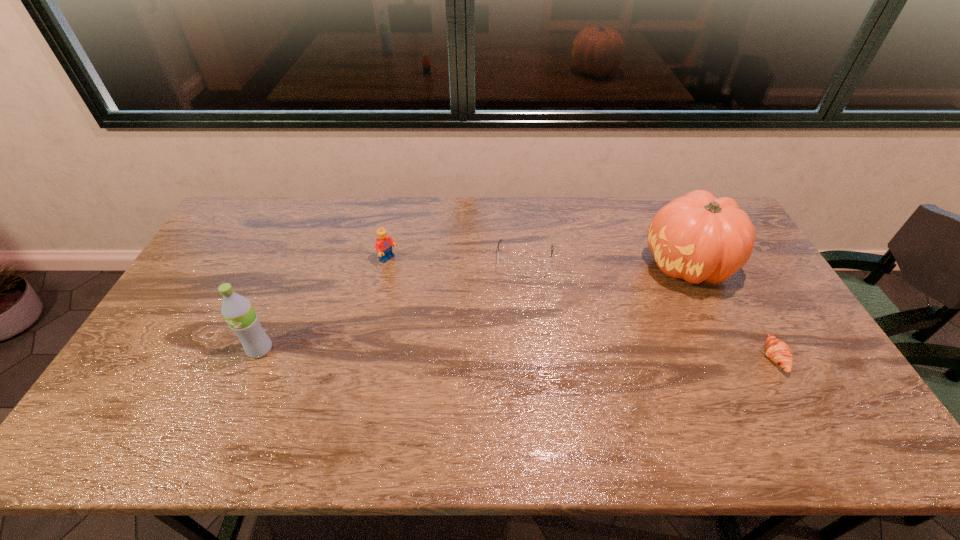
The image size is (960, 540). In order to click on vacant space located 0.130m on the front-facing side of the shortest object in this screenshot , I will do `click(715, 357)`.

You are a GUI agent. You are given a task and a screenshot of the screen. Output one action in this format:
    pyautogui.click(x=<x>, y=<y>)
    Task: Click on the vacant region located through the lenses of the spectacles
    The width and height of the screenshot is (960, 540).
    Given the screenshot: What is the action you would take?
    pyautogui.click(x=518, y=307)

Identify the location of free space located through the lenses of the spectacles. The width and height of the screenshot is (960, 540). (511, 354).

I want to click on free space located 0.400m through the lenses of the spectacles, so click(x=505, y=389).

Where is `vacant space located 0.250m on the face of the Lego`? Image resolution: width=960 pixels, height=540 pixels. vacant space located 0.250m on the face of the Lego is located at coordinates (452, 302).

At what (x,y) coordinates should I click in order to perform the action: click on free region located 0.230m on the face of the Lego. Please return your answer as a coordinate pair (x, y). The height and width of the screenshot is (540, 960). Looking at the image, I should click on (447, 299).

Find the location of `vacant space located 0.330m on the face of the Lego`. vacant space located 0.330m on the face of the Lego is located at coordinates (472, 315).

This screenshot has width=960, height=540. Find the location of `vacant space located on the carved face of the pumpkin`. vacant space located on the carved face of the pumpkin is located at coordinates (576, 338).

At what (x,y) coordinates should I click in order to perform the action: click on free space located on the carved face of the pumpkin. Please return your answer as a coordinate pair (x, y). Looking at the image, I should click on (627, 305).

What are the coordinates of `vacant space located on the carved face of the pumpkin` in the screenshot? It's located at (634, 300).